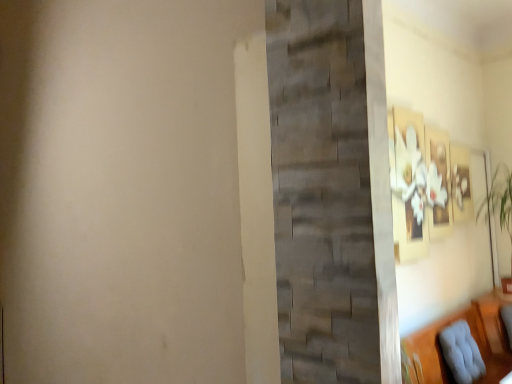
This screenshot has width=512, height=384. Find the location of `matte floral print at upper right`. matte floral print at upper right is located at coordinates (438, 182).

What do you see at coordinates (438, 182) in the screenshot? I see `matte floral print at upper right` at bounding box center [438, 182].

The image size is (512, 384). Identify the location of matte floral print at upper right. click(438, 182).